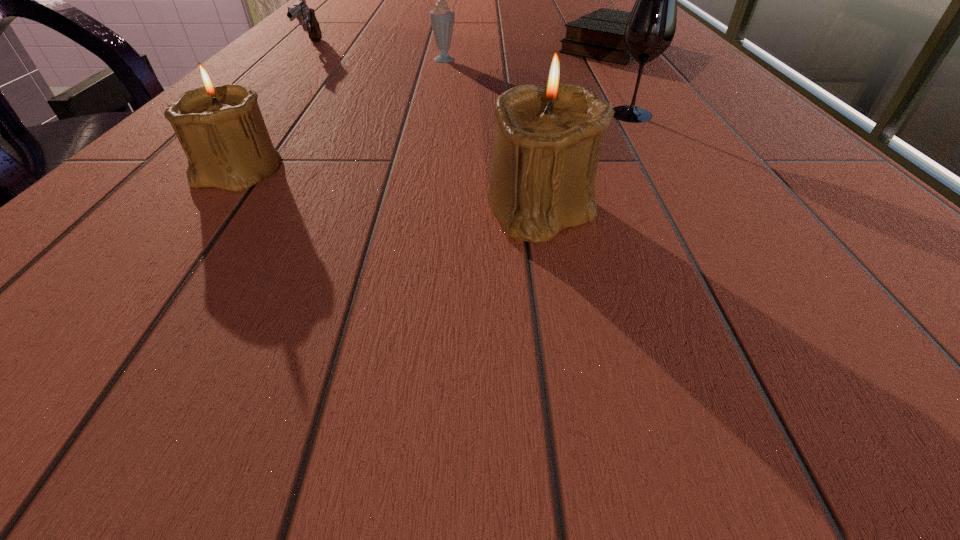
Where is `free space between the book and the milkshake`? The width and height of the screenshot is (960, 540). free space between the book and the milkshake is located at coordinates (529, 53).

You are a GUI agent. You are given a task and a screenshot of the screen. Output one action in this format:
    pyautogui.click(x=<x>, y=<y>)
    Task: Click on the vacant area that lies between the shorter candle_holder and the third nearest object
    
    Given the screenshot: What is the action you would take?
    pyautogui.click(x=434, y=143)

Find the location of a particular element. The height and width of the screenshot is (540, 960). vacant area that lies between the pistol and the fourth object from right to left is located at coordinates (379, 54).

Find the location of `vacant space that's between the right candle_holder and the fifth tallest object`. vacant space that's between the right candle_holder and the fifth tallest object is located at coordinates (425, 127).

The width and height of the screenshot is (960, 540). What are the coordinates of `empty space that is in between the shorter candle_holder and the shortest object` in the screenshot? It's located at (424, 110).

This screenshot has height=540, width=960. I want to click on vacant point located between the fourth farthest object and the pistol, so click(470, 81).

The height and width of the screenshot is (540, 960). Find the location of `vacant space in between the left candle_holder and the pistol`. vacant space in between the left candle_holder and the pistol is located at coordinates (275, 110).

Locate which object is the fifth closest to the pistol. Please provide its 2D coordinates. Your answer should be formatted as a tuple, i.e. [(x, y)], where the tuple contains the x and y coordinates of a point satisfying the conditions above.

[(650, 28)]

Select which object is the closest to the wineglass. Please provide its 2D coordinates. Your answer should be formatted as a tuple, i.e. [(x, y)], where the tuple contains the x and y coordinates of a point satisfying the conditions above.

[(548, 136)]

At what (x,y) coordinates should I click in order to perform the action: click on free space that satisfies the following two spatial constraints: 1. on the straw side of the milkshake; 2. on the right side of the right candle_holder. Please return your answer as a coordinate pair (x, y). This screenshot has width=960, height=540. Looking at the image, I should click on (424, 207).